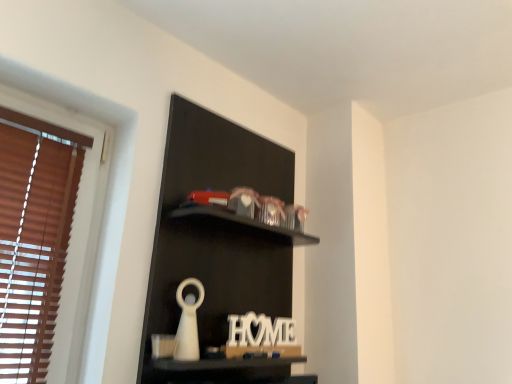
Question: From the image's perspective, does white wood letter at center appear lower than black matte shelf at upper center?

Choices:
 (A) no
 (B) yes

Answer: (B)

Question: Is white wood letter at center in front of black matte shelf at upper center?

Choices:
 (A) no
 (B) yes

Answer: (A)

Question: Is white wood letter at center at the right side of black matte shelf at upper center?

Choices:
 (A) no
 (B) yes

Answer: (B)

Question: Considering the relative positions of white wood letter at center and black matte shelf at upper center in the image provided, is white wood letter at center to the left of black matte shelf at upper center from the viewer's perspective?

Choices:
 (A) yes
 (B) no

Answer: (B)

Question: Is white wood letter at center facing towards black matte shelf at upper center?

Choices:
 (A) no
 (B) yes

Answer: (B)

Question: Can you confirm if white wood letter at center is taller than black matte shelf at upper center?

Choices:
 (A) yes
 (B) no

Answer: (B)

Question: Can you confirm if black matte shelf at upper center is bigger than white wood letter at center?

Choices:
 (A) yes
 (B) no

Answer: (A)

Question: Can you confirm if black matte shelf at upper center is positioned to the right of white wood letter at center?

Choices:
 (A) yes
 (B) no

Answer: (B)

Question: Does black matte shelf at upper center have a greater height compared to white wood letter at center?

Choices:
 (A) yes
 (B) no

Answer: (A)

Question: Does black matte shelf at upper center come in front of white wood letter at center?

Choices:
 (A) no
 (B) yes

Answer: (B)

Question: Is the depth of black matte shelf at upper center greater than that of white wood letter at center?

Choices:
 (A) no
 (B) yes

Answer: (A)

Question: From the image's perspective, is black matte shelf at upper center beneath white wood letter at center?

Choices:
 (A) yes
 (B) no

Answer: (B)

Question: Would you say black matte shelf at upper center is inside or outside white wood letter at center?

Choices:
 (A) outside
 (B) inside

Answer: (A)